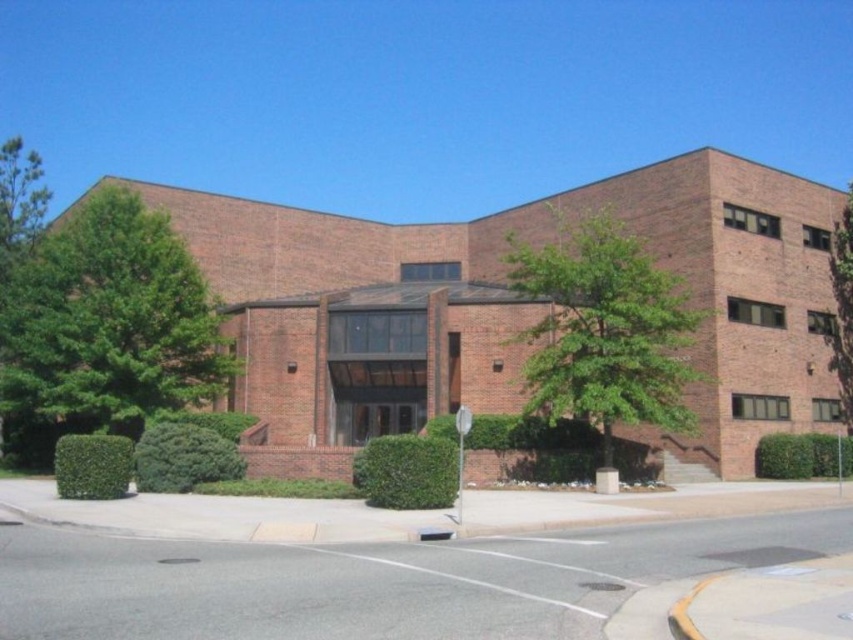
Question: Considering the real-world distances, which object is farthest from the green leafy tree at right?

Choices:
 (A) green leafy tree at center
 (B) brick building at center

Answer: (B)

Question: Which object is farther from the camera taking this photo?

Choices:
 (A) green leafy tree at right
 (B) green leafy tree at left
 (C) green leafy tree at center
 (D) brick building at center

Answer: (A)

Question: Can you confirm if brick building at center is smaller than green leafy tree at right?

Choices:
 (A) yes
 (B) no

Answer: (A)

Question: Does green leafy tree at left lie in front of green leafy tree at center?

Choices:
 (A) no
 (B) yes

Answer: (A)

Question: Does brick building at center have a smaller size compared to green leafy tree at center?

Choices:
 (A) yes
 (B) no

Answer: (B)

Question: Estimate the real-world distances between objects in this image. Which object is closer to the green leafy tree at left?

Choices:
 (A) green leafy tree at right
 (B) green leafy tree at center

Answer: (B)